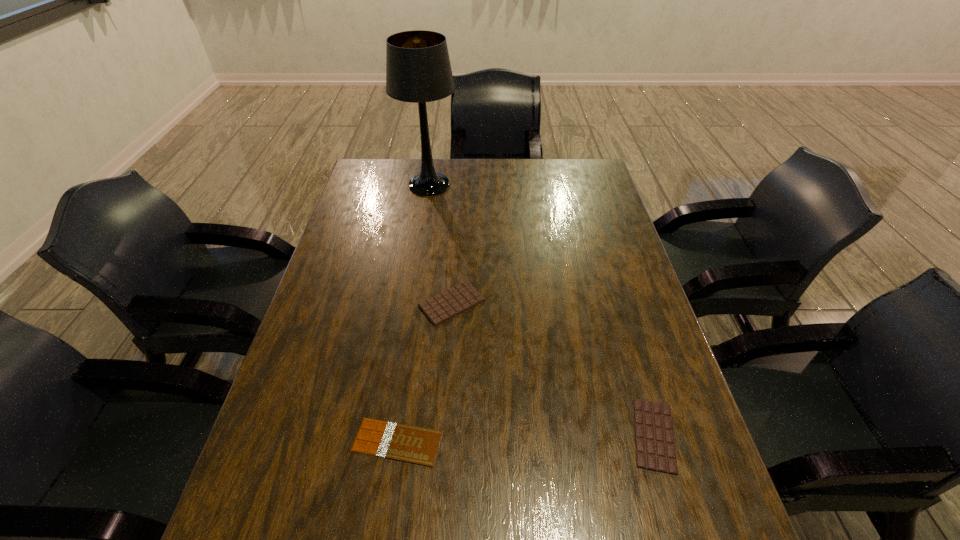
Find the location of a particular element. table lamp is located at coordinates (418, 70).

I want to click on the tallest object, so click(x=418, y=70).

Where is `the third nearest object`? the third nearest object is located at coordinates (452, 302).

Find the location of `the tallest chocolate bar`. the tallest chocolate bar is located at coordinates (452, 302).

Image resolution: width=960 pixels, height=540 pixels. I want to click on the second shortest chocolate bar, so click(655, 449).

At what (x,y) coordinates should I click in order to perform the action: click on the rightmost object. Please return your answer as a coordinate pair (x, y). Looking at the image, I should click on (655, 449).

Identify the location of the shortest chocolate bar. This screenshot has width=960, height=540. (396, 441).

At what (x,y) coordinates should I click in order to perform the action: click on free spot located 0.190m on the front of the tallest object. Please return your answer as a coordinate pair (x, y). The image size is (960, 540). Looking at the image, I should click on (421, 235).

This screenshot has width=960, height=540. I want to click on blank space located on the back of the third nearest object, so click(457, 221).

Where is `vacant region located on the left of the second tallest chocolate bar`? The width and height of the screenshot is (960, 540). vacant region located on the left of the second tallest chocolate bar is located at coordinates (543, 435).